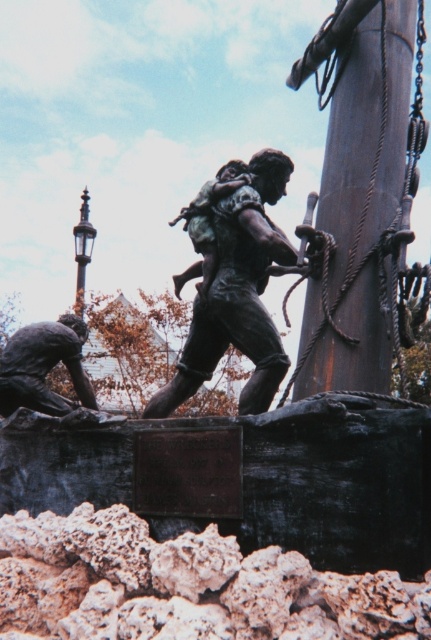
Does rusty metal rock at lower center appear under bronze/brass streetlamp at upper left?

Indeed, rusty metal rock at lower center is positioned under bronze/brass streetlamp at upper left.

Can you confirm if rusty metal rock at lower center is wider than bronze/brass streetlamp at upper left?

Yes.

Describe the element at coordinates (184, 586) in the screenshot. I see `rusty metal rock at lower center` at that location.

In order to click on rusty metal rock at lower center in this screenshot , I will do `click(184, 586)`.

Measure the distance between rusty metal rock at lower center and camera.

The distance of rusty metal rock at lower center from camera is 109.94 feet.

Does rusty metal rock at lower center have a lesser height compared to bronze statue at center?

Yes.

Which is behind, point (53, 554) or point (149, 413)?

Positioned behind is point (149, 413).

Identify the location of rusty metal rock at lower center. This screenshot has width=431, height=640. (184, 586).

Who is positioned more to the right, rusty wood pole at right or bronze statue at lower left?

From the viewer's perspective, rusty wood pole at right appears more on the right side.

Can you confirm if rusty wood pole at right is positioned above bronze statue at lower left?

Correct, rusty wood pole at right is located above bronze statue at lower left.

The image size is (431, 640). Identify the location of rusty wood pole at right. (364, 148).

What are the coordinates of `rusty wood pole at right` in the screenshot? It's located at (364, 148).